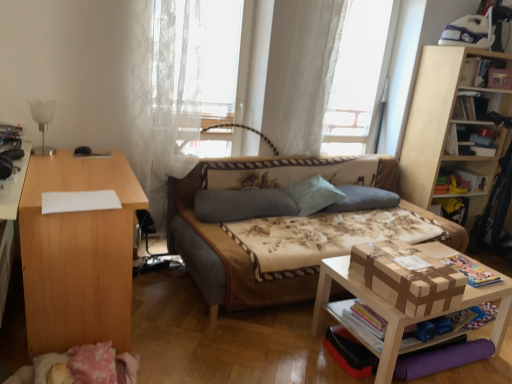
I want to click on vacant space to the left of white wood table at lower right, positioned as the second table in left-to-right order, so click(x=276, y=344).